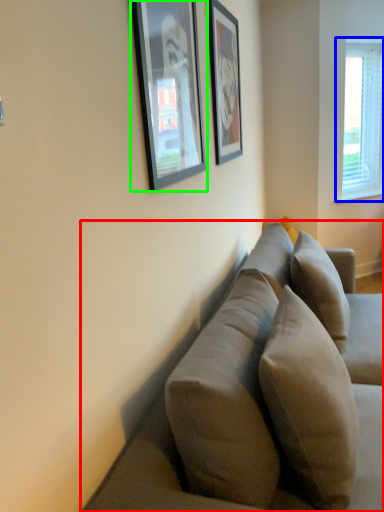
Question: Estimate the real-world distances between objects in this image. Which object is closer to studio couch (highlighted by a red box), window (highlighted by a blue box) or picture frame (highlighted by a green box)?

Choices:
 (A) window
 (B) picture frame

Answer: (B)